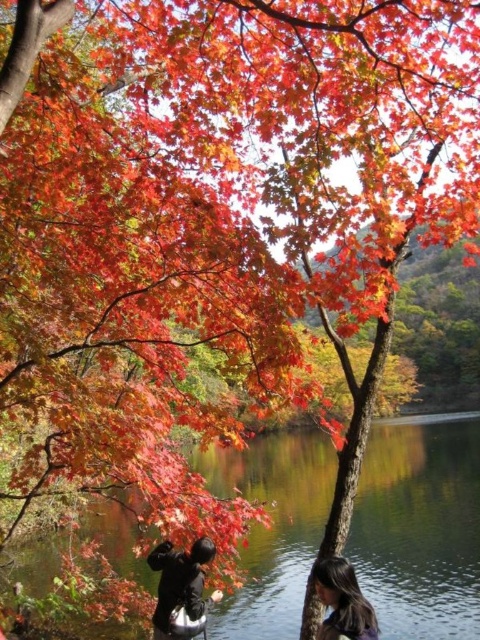
From the picture: You are standing at the edge of the lake and see the clear water at center and the black matte jacket at lower center. Which object takes up more space in the image?

The clear water at center takes up more space in the image because it is bigger than the black matte jacket at lower center.

Based on the photo, you are standing at the edge of the lake and see two points in the scene. The first point is labeled as point (210, 621) and the second is point (325, 628). Which point is closer to you?

Point (210, 621) is closer to you because it is further to the viewer than point (325, 628).